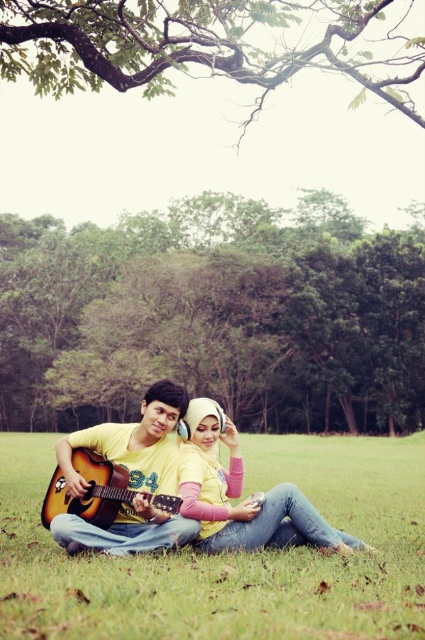
Describe the element at coordinates (215, 316) in the screenshot. I see `green leafy tree at center` at that location.

Locate an element on the screen. The width and height of the screenshot is (425, 640). green leafy tree at center is located at coordinates (215, 316).

Which is behind, point (300, 232) or point (5, 477)?

The point (300, 232) is behind.

Who is more forward, (257,324) or (348,499)?

Point (348,499) is in front.

What are the coordinates of `green leafy tree at center` in the screenshot? It's located at (215, 316).

Can you confirm if matte yellow shirt at center is wider than acoustic wood guitar at left?

Correct, the width of matte yellow shirt at center exceeds that of acoustic wood guitar at left.

Is point (269, 490) farther from viewer compared to point (150, 502)?

That is True.

Between point (235, 529) and point (102, 458), which one is positioned in front?

Point (235, 529) is in front.

Identify the location of matte yellow shirt at center. This screenshot has width=425, height=640. (240, 493).